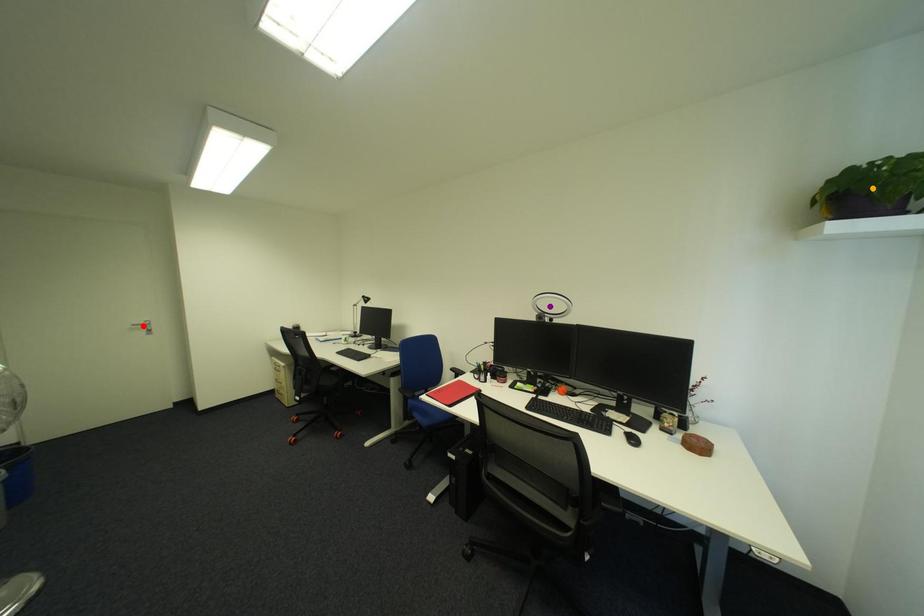
Order these from nearest to farthest:
orange point | red point | purple point

red point < purple point < orange point